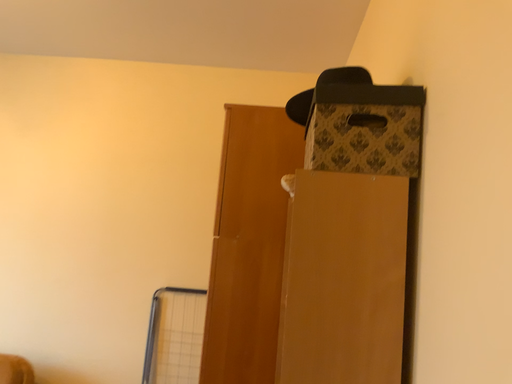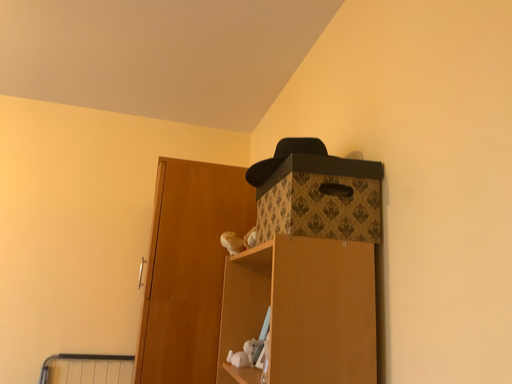
Question: How did the camera likely rotate when shooting the video?

Choices:
 (A) rotated right
 (B) rotated left

Answer: (A)